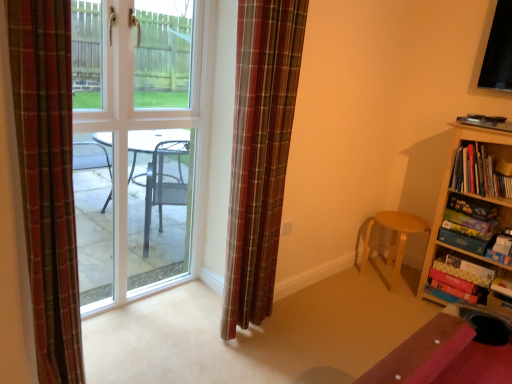
Question: Does plaid fabric curtain at center, which appears as the 2th curtain when viewed from the left, have a smaller size compared to wooden bookshelf at right?

Choices:
 (A) no
 (B) yes

Answer: (B)

Question: Can you confirm if plaid fabric curtain at center, acting as the first curtain starting from the right, is wider than wooden bookshelf at right?

Choices:
 (A) yes
 (B) no

Answer: (B)

Question: Is plaid fabric curtain at center, arranged as the second curtain when viewed from the front, in front of wooden bookshelf at right?

Choices:
 (A) no
 (B) yes

Answer: (B)

Question: Is plaid fabric curtain at center, acting as the first curtain starting from the right, positioned behind wooden bookshelf at right?

Choices:
 (A) no
 (B) yes

Answer: (A)

Question: Can you confirm if plaid fabric curtain at center, acting as the first curtain starting from the right, is positioned to the right of wooden bookshelf at right?

Choices:
 (A) yes
 (B) no

Answer: (B)

Question: From the image's perspective, is plaid fabric curtain at center, which appears as the 2th curtain when viewed from the left, on top of wooden bookshelf at right?

Choices:
 (A) yes
 (B) no

Answer: (A)

Question: Does clear glass door at center have a greater height compared to light brown wooden stool at lower right?

Choices:
 (A) yes
 (B) no

Answer: (A)

Question: Is clear glass door at center wider than light brown wooden stool at lower right?

Choices:
 (A) yes
 (B) no

Answer: (B)

Question: Does clear glass door at center appear on the right side of light brown wooden stool at lower right?

Choices:
 (A) yes
 (B) no

Answer: (B)

Question: Is clear glass door at center oriented away from light brown wooden stool at lower right?

Choices:
 (A) yes
 (B) no

Answer: (B)

Question: From a real-world perspective, is clear glass door at center beneath light brown wooden stool at lower right?

Choices:
 (A) yes
 (B) no

Answer: (B)

Question: Would you say clear glass door at center is a long distance from light brown wooden stool at lower right?

Choices:
 (A) no
 (B) yes

Answer: (B)

Question: Can you confirm if plaid fabric curtain at left, the 1th curtain viewed from the left, is bigger than wooden bookshelf at right?

Choices:
 (A) yes
 (B) no

Answer: (B)